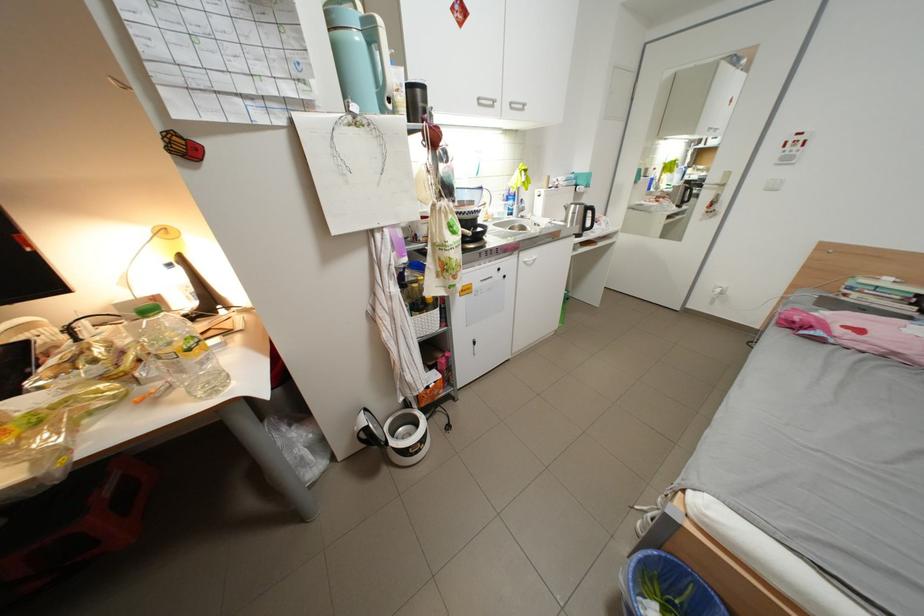
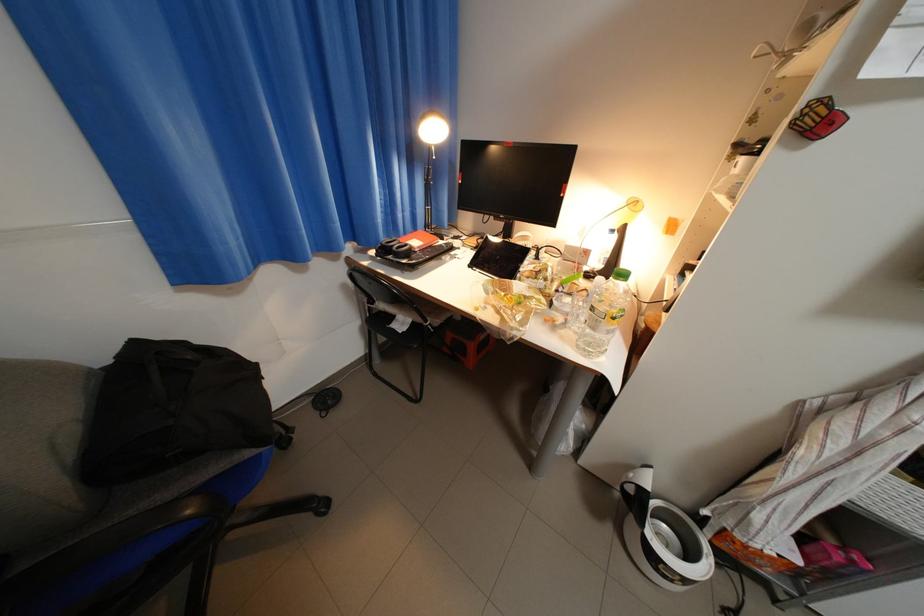
Where in the second image is the point corresponding to the point at 193,373 from the first image?

(605, 330)